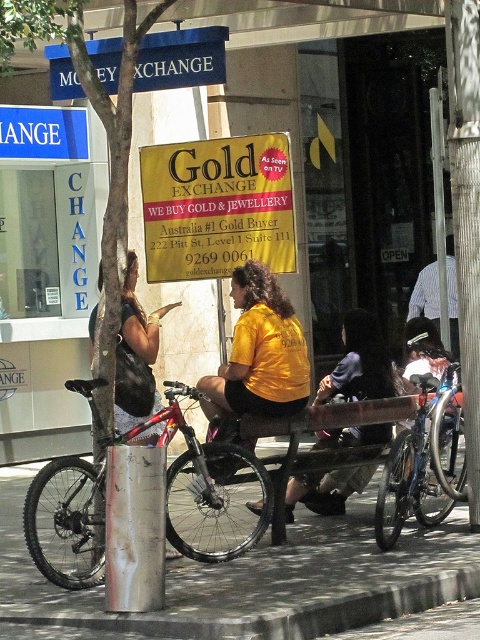
In the scene shown: How much distance is there between rusty metal pole at center and striped shirt at center?

rusty metal pole at center is 4.66 meters away from striped shirt at center.

Who is higher up, rusty metal pole at center or striped shirt at center?

striped shirt at center is above.

Find the location of a particular element. The height and width of the screenshot is (640, 480). rusty metal pole at center is located at coordinates (134, 529).

Locate an element on the screen. rusty metal pole at center is located at coordinates (134, 529).

What do you see at coordinates (134, 529) in the screenshot?
I see `rusty metal pole at center` at bounding box center [134, 529].

Find the location of a particular element. rusty metal pole at center is located at coordinates (134, 529).

Does point (132, 468) lie in front of point (15, 156)?

Yes.

Image resolution: width=480 pixels, height=640 pixels. Identify the location of rusty metal pole at center. (134, 529).

Can you confirm if red matte bicycle at center is bigger than smooth brown tree trunk at center?

Yes.

How much distance is there between red matte bicycle at center and smooth brown tree trunk at center?

They are 4.74 feet apart.

Where is `red matte bicycle at center`? The width and height of the screenshot is (480, 640). red matte bicycle at center is located at coordinates (211, 490).